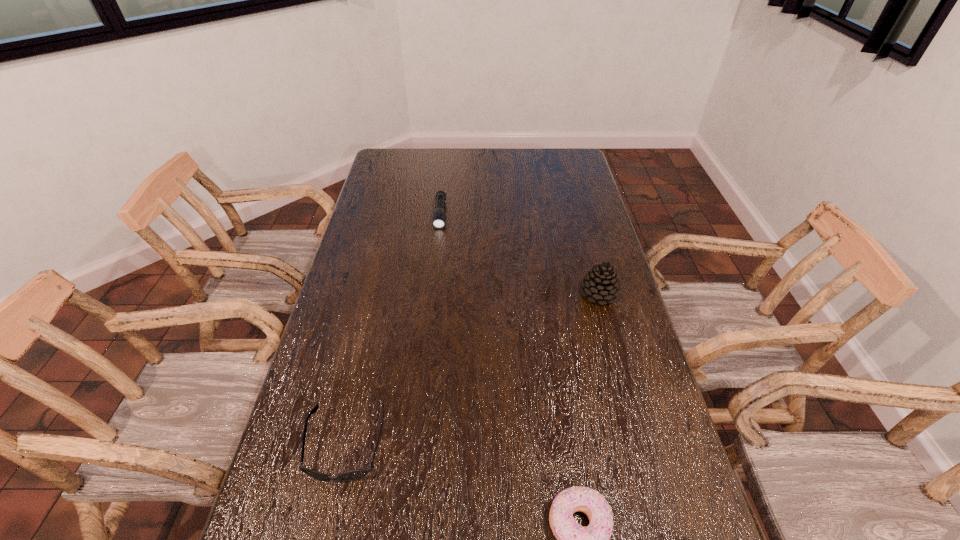
Image resolution: width=960 pixels, height=540 pixels. I want to click on sunglasses, so click(352, 475).

The image size is (960, 540). I want to click on the second nearest object, so click(x=352, y=475).

This screenshot has width=960, height=540. I want to click on the farthest object, so click(x=438, y=222).

You are a GUI agent. You are given a task and a screenshot of the screen. Output one action in this format:
    pyautogui.click(x=<x>, y=<y>)
    Task: Click on the second object from left to right
    The width and height of the screenshot is (960, 540).
    Given the screenshot: What is the action you would take?
    pyautogui.click(x=438, y=222)

Where is `the rightmost object`? This screenshot has width=960, height=540. the rightmost object is located at coordinates (601, 283).

This screenshot has width=960, height=540. What are the coordinates of `the third nearest object` in the screenshot? It's located at (601, 283).

What are the coordinates of `vacant space located 0.060m on the lenses of the sunglasses` in the screenshot? It's located at (330, 514).

Locate an element on the screen. The width and height of the screenshot is (960, 540). free space located at the lens end of the second object from left to right is located at coordinates (438, 245).

Where is `vacant space located at the lens end of the second object from left to right`? vacant space located at the lens end of the second object from left to right is located at coordinates (439, 238).

The height and width of the screenshot is (540, 960). I want to click on blank area located at the lens end of the second object from left to right, so click(434, 305).